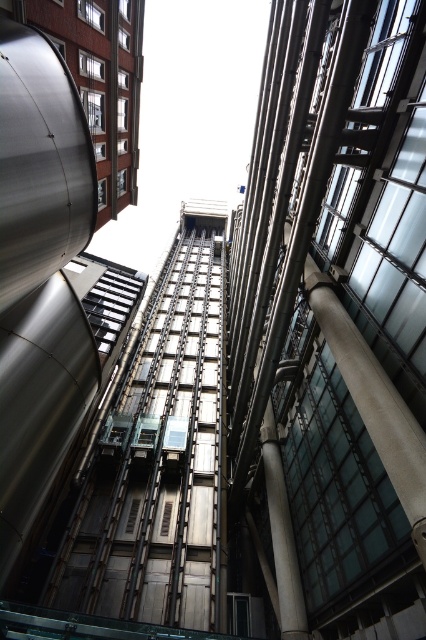
Between metallic glass elevator at center and metallic elevator at center, which one has less height?

Standing shorter between the two is metallic elevator at center.

Does point (252, 156) come in front of point (216, 584)?

No, (252, 156) is further to viewer.

This screenshot has width=426, height=640. Identify the location of metallic glass elevator at center. (331, 326).

Can you confirm if metallic glass elevator at center is wider than white glossy column at center?

Indeed, metallic glass elevator at center has a greater width compared to white glossy column at center.

Identify the location of metallic glass elevator at center. The image size is (426, 640). (331, 326).

The width and height of the screenshot is (426, 640). In order to click on metallic glass elevator at center in this screenshot , I will do `click(331, 326)`.

Find the location of a particular element. This screenshot has width=426, height=640. metallic elevator at center is located at coordinates (158, 454).

Between metallic elevator at center and white glossy column at center, which one appears on the left side from the viewer's perspective?

metallic elevator at center

Based on the photo, measure the distance between point (137,474) and camera.

A distance of 92.42 feet exists between point (137,474) and camera.

Find the location of a particular element. The image size is (426, 640). metallic elevator at center is located at coordinates 158,454.